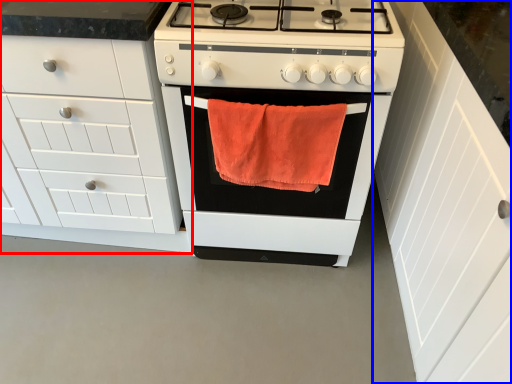
Question: Which of the following is the closest to the observer, cabinetry (highlighted by a red box) or cabinetry (highlighted by a blue box)?

Choices:
 (A) cabinetry
 (B) cabinetry

Answer: (B)